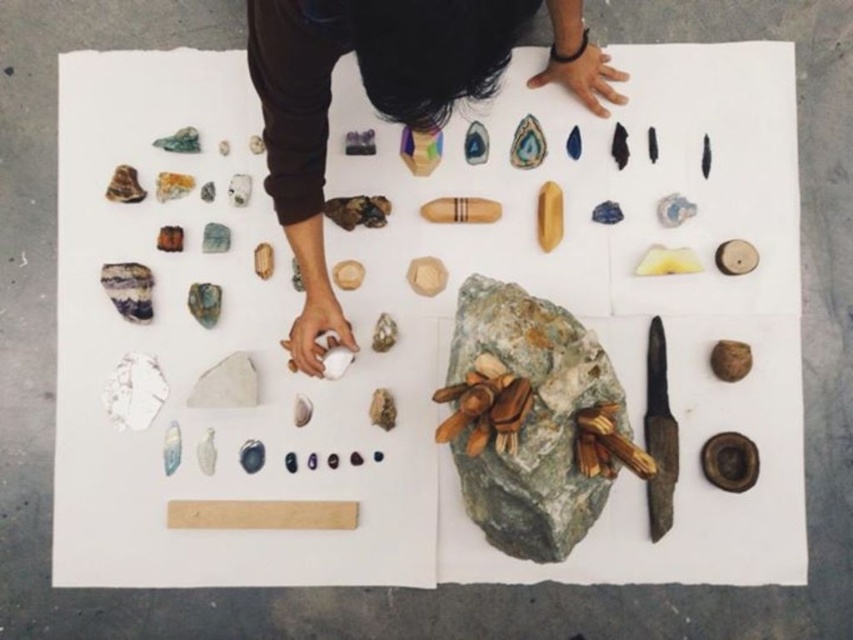
Does smooth brown hand at upper center appear on the left side of green rough stone at center?

Yes, smooth brown hand at upper center is to the left of green rough stone at center.

Is smooth brown hand at upper center above green rough stone at center?

Indeed, smooth brown hand at upper center is positioned over green rough stone at center.

What do you see at coordinates (386, 99) in the screenshot?
I see `smooth brown hand at upper center` at bounding box center [386, 99].

Where is `smooth brown hand at upper center`? Image resolution: width=853 pixels, height=640 pixels. smooth brown hand at upper center is located at coordinates (386, 99).